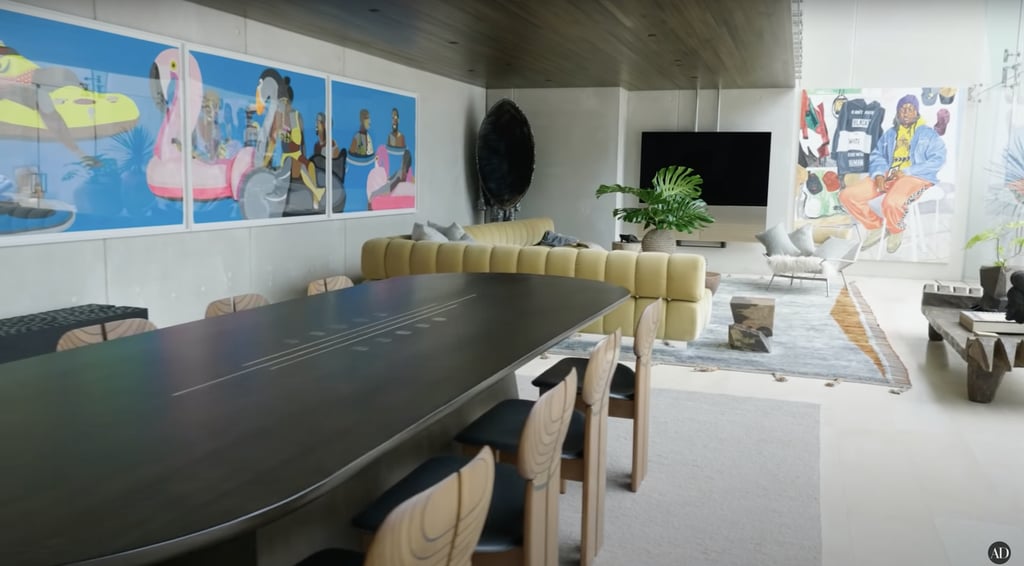
You are a GUI agent. You are given a task and a screenshot of the screen. Output one action in this format:
    pyautogui.click(x=<x>, y=<y>)
    Task: Click on the ornaments
    This screenshot has width=1024, height=566.
    Given the screenshot: What is the action you would take?
    pyautogui.click(x=500, y=147), pyautogui.click(x=743, y=323), pyautogui.click(x=1011, y=305), pyautogui.click(x=156, y=269)